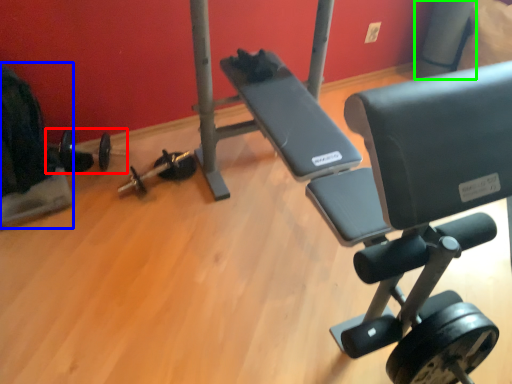
Question: Estimate the real-world distances between objects in this image. Which object is closer to barbell (highlighted by a red box), swivel chair (highlighted by a blue box) or pole (highlighted by a green box)?

Choices:
 (A) swivel chair
 (B) pole

Answer: (A)